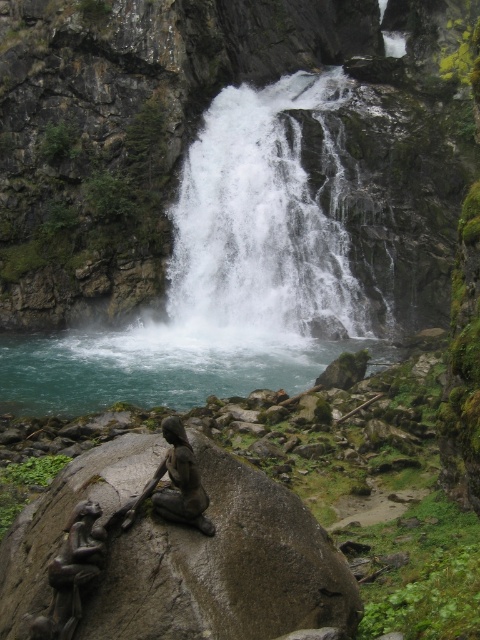
You are a photographer planning to take a picture of the teal smooth water at center and the bronze statue at center. Based on their sizes, which one should you focus on to ensure both are fully captured in the frame?

The teal smooth water at center is wider than the bronze statue at center, so focusing on the wider teal smooth water at center will ensure both are fully captured in the frame.

You are a tourist standing at the base of the waterfall. You notice the smooth gray rock at center and the white frothy water at center. Which object is located above the other?

The white frothy water at center is above the smooth gray rock at center because the rock is positioned under the water.